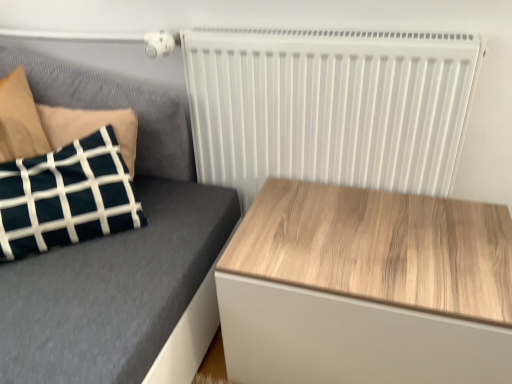
You are a GUI agent. You are given a task and a screenshot of the screen. Output one action in this format:
    pyautogui.click(x=<x>, y=<y>)
    Task: Click on the free space above wooden table at right (from a real-world perspective)
    This screenshot has width=512, height=384.
    Given the screenshot: What is the action you would take?
    pyautogui.click(x=379, y=235)